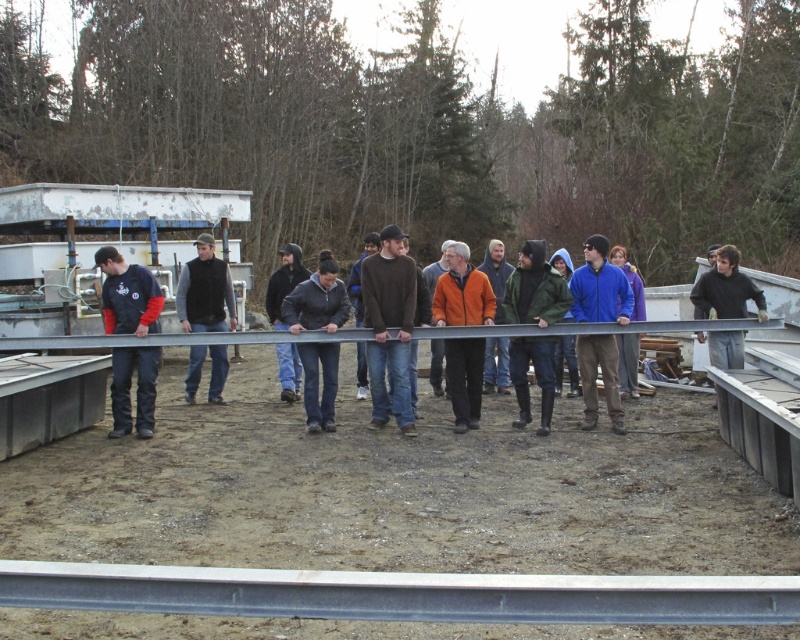
The height and width of the screenshot is (640, 800). Describe the element at coordinates (600, 285) in the screenshot. I see `blue fleece jacket at center` at that location.

Between blue fleece jacket at center and dark gray fleece jacket at center, which one has more height?

blue fleece jacket at center

Between point (620, 317) and point (332, 384), which one is positioned in front?

Point (620, 317)

Where is `blue fleece jacket at center`? The width and height of the screenshot is (800, 640). blue fleece jacket at center is located at coordinates (600, 285).

Which is behind, point (570, 280) or point (484, 272)?

The point (484, 272) is behind.

Does blue fleece jacket at center have a larger size compared to orange matte jacket at center?

No.

Between point (586, 248) and point (496, 294), which one is positioned in front?

Point (586, 248)

Locate an element on the screen. This screenshot has width=800, height=640. blue fleece jacket at center is located at coordinates (600, 285).

Who is lower down, orange fleece jacket at center or dark gray fleece jacket at center?

dark gray fleece jacket at center

In the scene shown: Is orange fleece jacket at center taller than dark gray fleece jacket at center?

Correct, orange fleece jacket at center is much taller as dark gray fleece jacket at center.

Which is behind, point (458, 372) or point (310, 410)?

The point (310, 410) is more distant.

The image size is (800, 640). What are the coordinates of `orange fleece jacket at center` in the screenshot? It's located at (462, 292).